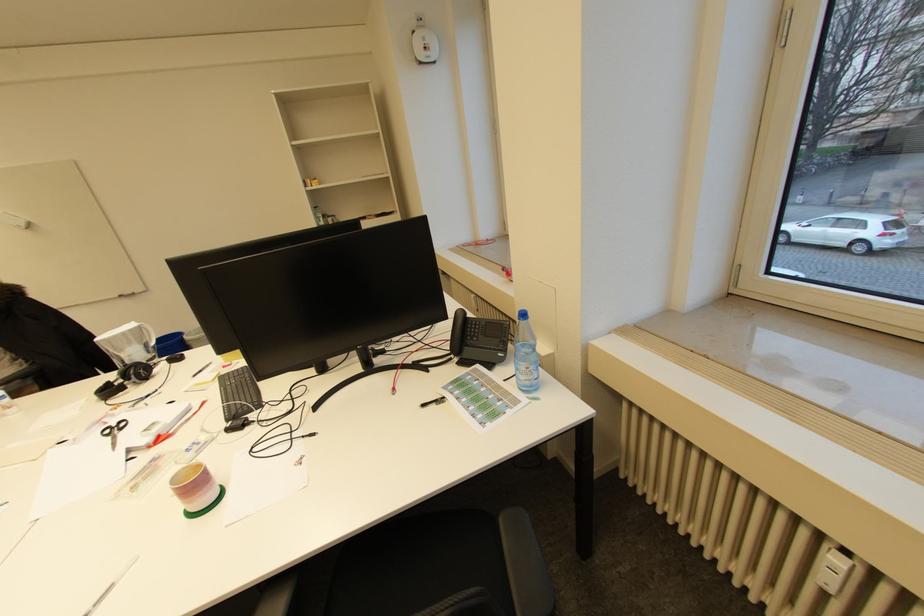
Where would you rest the black chair armrest? Please return your answer as a coordinate pair (x, y).

(525, 565)